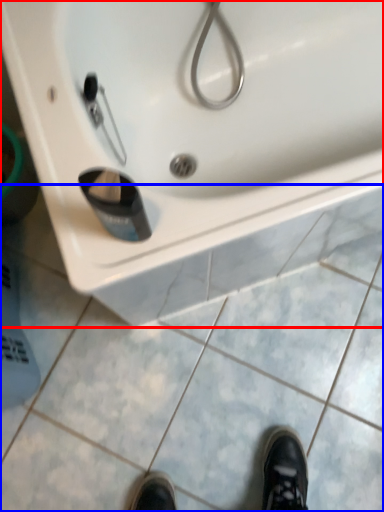
Question: Which point is closer to the camera, sink (highlighted by a red box) or tile (highlighted by a blue box)?

Choices:
 (A) sink
 (B) tile

Answer: (A)